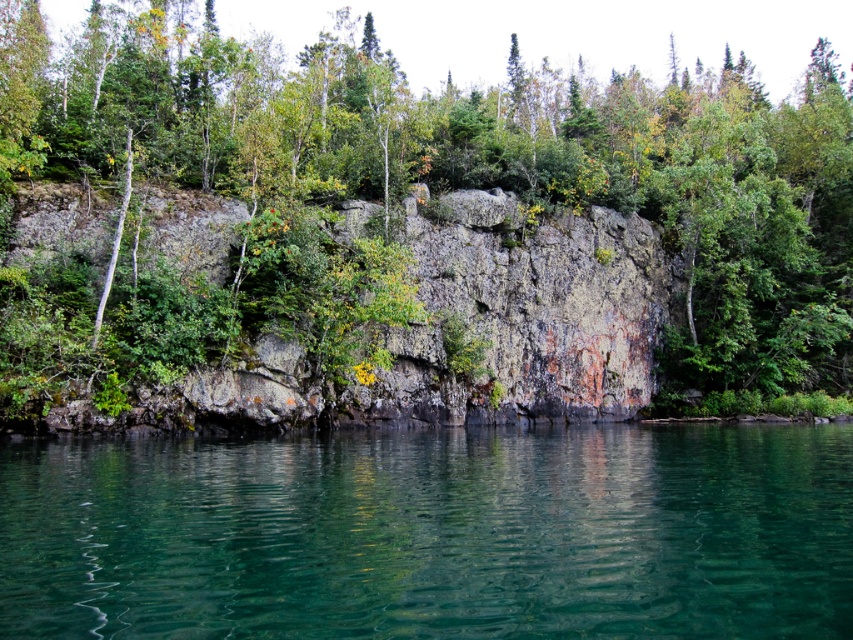
Question: Which object appears farthest from the camera in this image?

Choices:
 (A) green leafy tree at upper center
 (B) clear glass water at center
 (C) rusty stone cliff at center

Answer: (A)

Question: Does green leafy tree at upper center come behind clear glass water at center?

Choices:
 (A) no
 (B) yes

Answer: (B)

Question: Does green leafy tree at upper center come in front of clear glass water at center?

Choices:
 (A) yes
 (B) no

Answer: (B)

Question: Which object is positioned closest to the clear glass water at center?

Choices:
 (A) green leafy tree at upper center
 (B) rusty stone cliff at center

Answer: (B)

Question: Estimate the real-world distances between objects in this image. Which object is closer to the rusty stone cliff at center?

Choices:
 (A) green leafy tree at upper center
 (B) clear glass water at center

Answer: (B)

Question: Can you confirm if green leafy tree at upper center is wider than clear glass water at center?

Choices:
 (A) no
 (B) yes

Answer: (B)